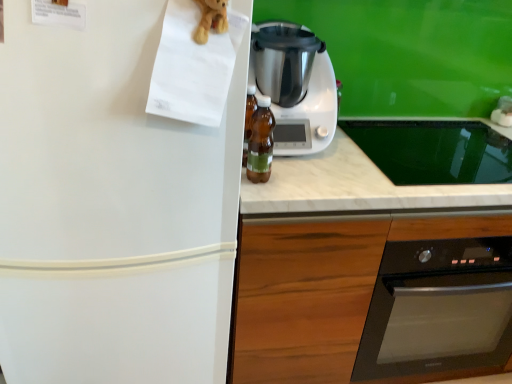
Describe the element at coordinates (353, 186) in the screenshot. I see `white marble countertop at center` at that location.

Describe the element at coordinates (323, 285) in the screenshot. The image size is (512, 384). I see `wooden at center` at that location.

Where is `white matte refrigerator at left`? white matte refrigerator at left is located at coordinates pyautogui.click(x=111, y=207).

What are the coordinates of `white marble countertop at center` in the screenshot? It's located at (353, 186).

Which object is positioned more to the left, white matte refrigerator at left or wooden at center?

Positioned to the left is white matte refrigerator at left.

In terms of size, does white matte refrigerator at left appear bigger or smaller than wooden at center?

white matte refrigerator at left is smaller than wooden at center.

Is wooden at center a part of white matte refrigerator at left?

No.

Is translucent amber bottle at center thinner than white marble countertop at center?

Yes, translucent amber bottle at center is thinner than white marble countertop at center.

Does point (249, 151) appear closer or farther from the camera than point (481, 195)?

Clearly, point (249, 151) is closer to the camera than point (481, 195).

Are translucent amber bottle at center and white marble countertop at center making contact?

No, translucent amber bottle at center is not next to white marble countertop at center.

Looking at this image, are white plastic blender at center and white matte refrigerator at left located far from each other?

That's not correct — white plastic blender at center is a little close to white matte refrigerator at left.

Considering the sizes of objects white plastic blender at center and white matte refrigerator at left in the image provided, who is taller, white plastic blender at center or white matte refrigerator at left?

white matte refrigerator at left.

Between white plastic blender at center and white matte refrigerator at left, which one has larger size?

With larger size is white matte refrigerator at left.

From the picture: Between white marble countertop at center and wooden at center, which one is positioned in front?

wooden at center is closer to the camera.

In the scene shown: Can you tell me how much white marble countertop at center and wooden at center differ in facing direction?

The angle between the facing direction of white marble countertop at center and the facing direction of wooden at center is 0.000418 degrees.

Is white marble countertop at center thinner than wooden at center?

Correct, the width of white marble countertop at center is less than that of wooden at center.

Is wooden at center located within white marble countertop at center?

Actually, wooden at center is outside white marble countertop at center.

From a real-world perspective, between brown plush toy at upper left and wooden at center, who is vertically lower?

In real-world perspective, wooden at center is lower.

Considering the relative sizes of brown plush toy at upper left and wooden at center in the image provided, is brown plush toy at upper left shorter than wooden at center?

Correct, brown plush toy at upper left is not as tall as wooden at center.

Is point (222, 25) positioned behind point (255, 292)?

No, it is in front of (255, 292).

From a real-world perspective, which object rests below the other?

From a 3D spatial view, white matte refrigerator at left is below.

Is translucent amber bottle at center far away from white matte refrigerator at left?

translucent amber bottle at center is actually quite close to white matte refrigerator at left.

Is translucent amber bottle at center oriented towards white matte refrigerator at left?

No, translucent amber bottle at center is not facing towards white matte refrigerator at left.

Relative to white matte refrigerator at left, is translucent amber bottle at center in front or behind?

translucent amber bottle at center is behind white matte refrigerator at left.

Can you confirm if translucent amber bottle at center is taller than wooden at center?

A: Incorrect, the height of translucent amber bottle at center is not larger of that of wooden at center.

Locate an element on the screen. This screenshot has width=512, height=384. cabinetry behind the translucent amber bottle at center is located at coordinates (323, 285).

Is point (257, 116) positioned after point (287, 287)?

No, it is in front of (287, 287).

Between translucent amber bottle at center and wooden at center, which one has smaller width?

translucent amber bottle at center is thinner.

Locate an element on the screen. refrigerator in front of the wooden at center is located at coordinates (111, 207).

Where is `bottle above the white marble countertop at center (from the image's perspective)`? bottle above the white marble countertop at center (from the image's perspective) is located at coordinates (261, 141).

Estimate the real-world distances between objects in this image. Which object is closer to translucent amber bottle at center, brown plush toy at upper left or white matte refrigerator at left?

Based on the image, white matte refrigerator at left appears to be nearer to translucent amber bottle at center.

Which object lies nearer to the anchor point white marble countertop at center, translucent amber bottle at center or brown plush toy at upper left?

Among the two, translucent amber bottle at center is located nearer to white marble countertop at center.

Considering their positions, is translucent amber bottle at center positioned closer to wooden at center than white marble countertop at center?

white marble countertop at center.

Looking at this image, based on their spatial positions, is translucent amber bottle at center or white matte refrigerator at left further from wooden at center?

translucent amber bottle at center is further to wooden at center.

Looking at the image, which one is located closer to brown plush toy at upper left, wooden at center or white matte refrigerator at left?

white matte refrigerator at left lies closer to brown plush toy at upper left than the other object.

Looking at the image, which one is located further to wooden at center, translucent amber bottle at center or white plastic blender at center?

white plastic blender at center lies further to wooden at center than the other object.

Based on their spatial positions, is translucent amber bottle at center or brown plush toy at upper left closer to wooden at center?

translucent amber bottle at center.

Consider the image. Estimate the real-world distances between objects in this image. Which object is closer to brown plush toy at upper left, white marble countertop at center or translucent amber bottle at center?

translucent amber bottle at center is closer to brown plush toy at upper left.

The width and height of the screenshot is (512, 384). In order to click on animal between white matte refrigerator at left and white marble countertop at center in this screenshot , I will do `click(211, 19)`.

Find the location of `animal between white matte refrigerator at left and wooden at center`. animal between white matte refrigerator at left and wooden at center is located at coordinates (211, 19).

Where is `kitchen appliance situated between translucent amber bottle at center and wooden at center from left to right`? This screenshot has height=384, width=512. kitchen appliance situated between translucent amber bottle at center and wooden at center from left to right is located at coordinates (295, 86).

Locate an element on the screen. This screenshot has height=384, width=512. kitchen appliance located between brown plush toy at upper left and white marble countertop at center in the left-right direction is located at coordinates (295, 86).